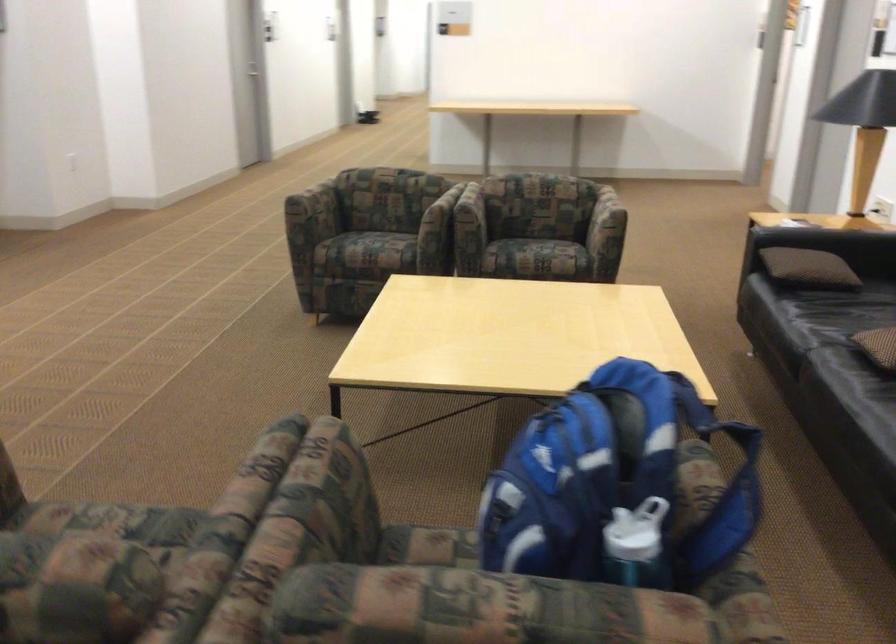
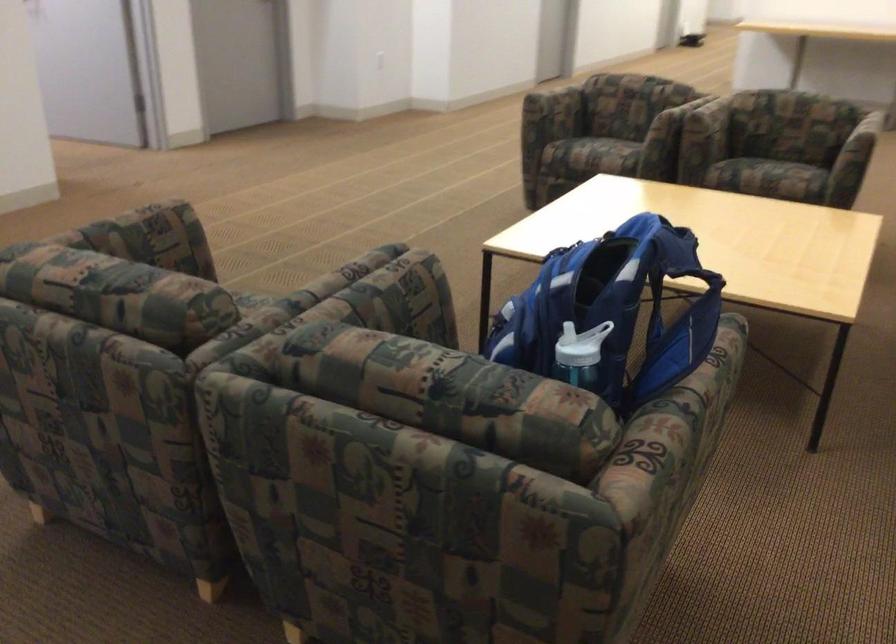
Find the pixel in the second image that matches (x=320, y=210) in the first image.

(554, 108)